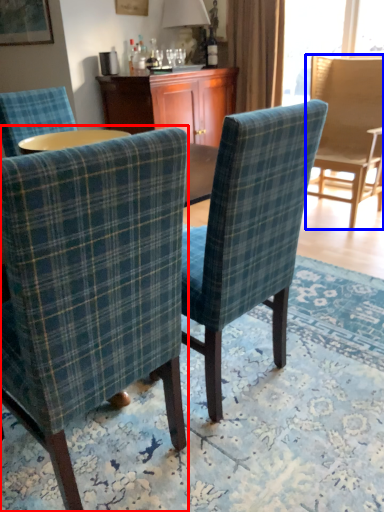
Question: Which point is closer to the camera, chair (highlighted by a red box) or chair (highlighted by a blue box)?

Choices:
 (A) chair
 (B) chair

Answer: (A)